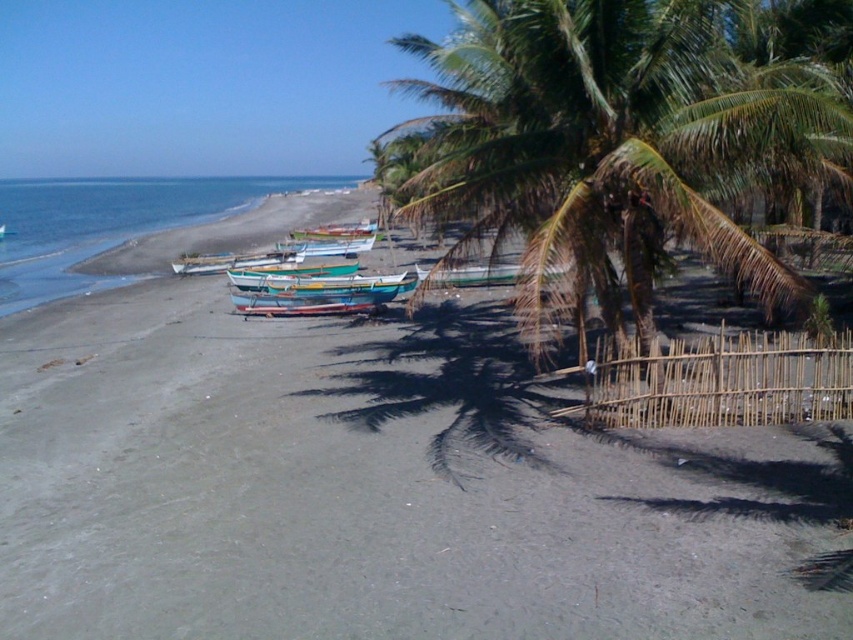
Question: Among these points, which one is nearest to the camera?

Choices:
 (A) (312, 253)
 (B) (344, 232)
 (C) (553, 268)

Answer: (C)

Question: Is green leafy coconut tree at center to the right of green painted wooden boat at center from the viewer's perspective?

Choices:
 (A) no
 (B) yes

Answer: (B)

Question: Estimate the real-world distances between objects in this image. Which object is closer to the blue water at lower left?

Choices:
 (A) green painted wooden boat at center
 (B) green leafy coconut tree at center
 (C) wooden painted boat at center
 (D) gray sand at center

Answer: (B)

Question: Among these points, which one is farthest from the camera?

Choices:
 (A) (129, 198)
 (B) (309, 237)

Answer: (A)

Question: Can you confirm if green leafy coconut tree at center is positioned to the right of blue water at lower left?

Choices:
 (A) no
 (B) yes

Answer: (B)

Question: Observing the image, what is the correct spatial positioning of green leafy coconut tree at center in reference to wooden boat at center?

Choices:
 (A) left
 (B) right

Answer: (A)